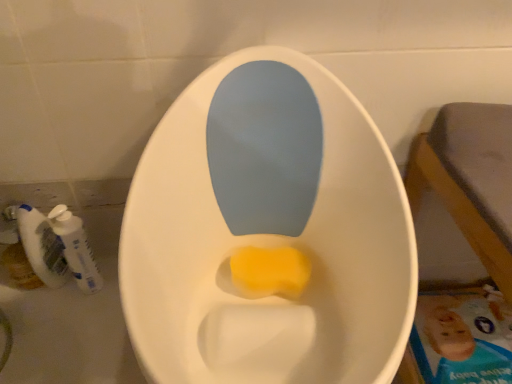
Question: From a real-world perspective, is white plastic mouthwash at lower left, which appears as the second mouthwash when viewed from the right, on white plastic mouthwash at left, which is counted as the first mouthwash, starting from the right?

Choices:
 (A) yes
 (B) no

Answer: (A)

Question: Is white plastic mouthwash at lower left, which appears as the second mouthwash when viewed from the right, aimed at white plastic mouthwash at left, which is counted as the first mouthwash, starting from the right?

Choices:
 (A) no
 (B) yes

Answer: (A)

Question: Is white plastic mouthwash at lower left, which is counted as the first mouthwash, starting from the left, thinner than white plastic mouthwash at left, which is counted as the first mouthwash, starting from the right?

Choices:
 (A) yes
 (B) no

Answer: (A)

Question: Does white plastic mouthwash at lower left, which is counted as the first mouthwash, starting from the left, appear on the right side of white plastic mouthwash at left, the 2th mouthwash when ordered from left to right?

Choices:
 (A) no
 (B) yes

Answer: (A)

Question: Is white plastic mouthwash at lower left, which is counted as the first mouthwash, starting from the left, shorter than white plastic mouthwash at left, which is counted as the first mouthwash, starting from the right?

Choices:
 (A) yes
 (B) no

Answer: (B)

Question: In terms of height, does white plastic mouthwash at lower left, which is counted as the first mouthwash, starting from the left, look taller or shorter compared to white plastic mouthwash at left, the 2th mouthwash when ordered from left to right?

Choices:
 (A) tall
 (B) short

Answer: (A)

Question: Looking at the image, does white plastic mouthwash at lower left, which appears as the second mouthwash when viewed from the right, seem bigger or smaller compared to white plastic mouthwash at left, the 2th mouthwash when ordered from left to right?

Choices:
 (A) small
 (B) big

Answer: (A)

Question: From a real-world perspective, relative to white plastic mouthwash at left, which is counted as the first mouthwash, starting from the right, is white plastic mouthwash at lower left, which is counted as the first mouthwash, starting from the left, vertically above or below?

Choices:
 (A) above
 (B) below

Answer: (A)

Question: Is point tap(54, 261) closer or farther from the camera than point tap(69, 251)?

Choices:
 (A) farther
 (B) closer

Answer: (A)

Question: Which is correct: yellow sponge at center is inside white plastic mouthwash at left, which is counted as the first mouthwash, starting from the right, or outside of it?

Choices:
 (A) outside
 (B) inside

Answer: (A)

Question: Is yellow sponge at center in front of or behind white plastic mouthwash at left, the 2th mouthwash when ordered from left to right, in the image?

Choices:
 (A) behind
 (B) front

Answer: (B)

Question: Visually, is yellow sponge at center positioned to the left or to the right of white plastic mouthwash at left, the 2th mouthwash when ordered from left to right?

Choices:
 (A) right
 (B) left

Answer: (A)

Question: In terms of width, does yellow sponge at center look wider or thinner when compared to white plastic mouthwash at left, the 2th mouthwash when ordered from left to right?

Choices:
 (A) thin
 (B) wide

Answer: (B)

Question: Considering the positions of white plastic mouthwash at left, which is counted as the first mouthwash, starting from the right, and yellow sponge at center in the image, is white plastic mouthwash at left, which is counted as the first mouthwash, starting from the right, taller or shorter than yellow sponge at center?

Choices:
 (A) short
 (B) tall

Answer: (B)

Question: In the image, is white plastic mouthwash at left, which is counted as the first mouthwash, starting from the right, positioned in front of or behind yellow sponge at center?

Choices:
 (A) front
 (B) behind

Answer: (B)